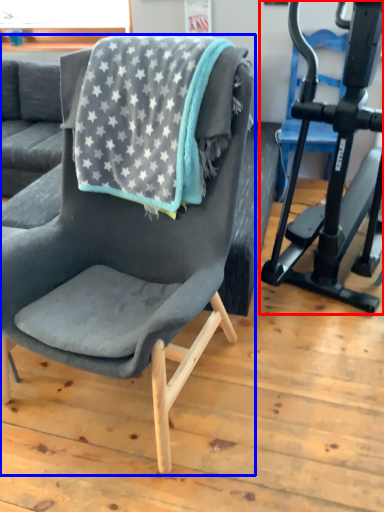
Question: Which of the following is the farthest to the observer, stationary bicycle (highlighted by a red box) or chair (highlighted by a blue box)?

Choices:
 (A) stationary bicycle
 (B) chair

Answer: (A)